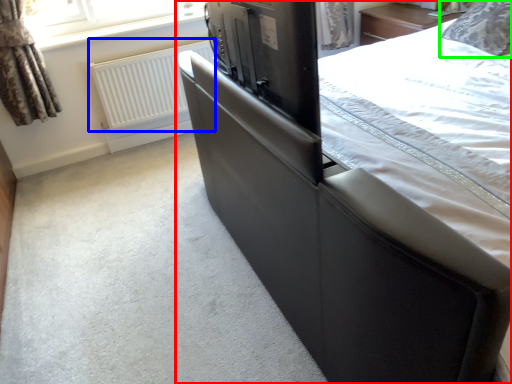
Question: Based on their relative distances, which object is farther from bed (highlighted by a red box)? Choose from radiator (highlighted by a blue box) and pillow (highlighted by a green box).

Choices:
 (A) radiator
 (B) pillow

Answer: (A)